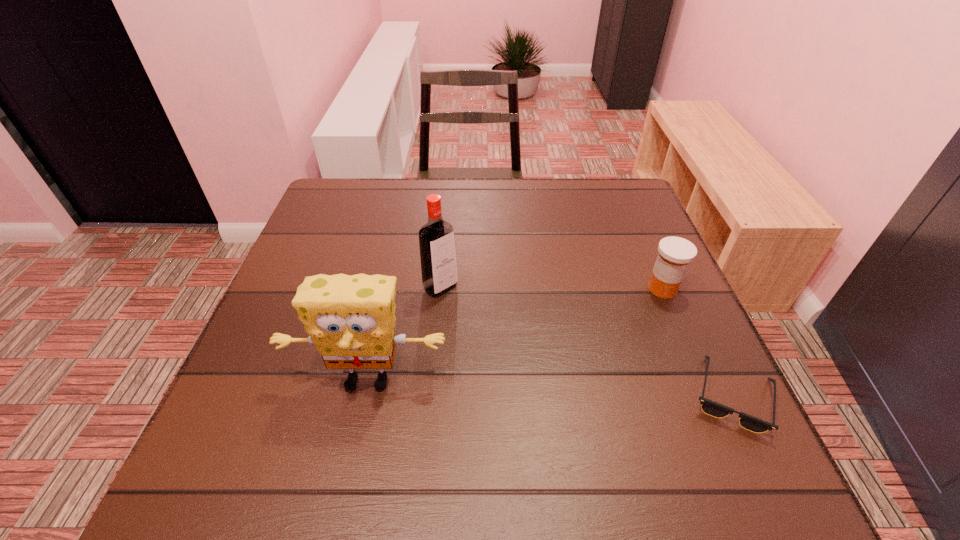
The height and width of the screenshot is (540, 960). I want to click on unoccupied position between the vodka and the sunglasses, so click(587, 341).

Find the location of a particular element. Image resolution: width=960 pixels, height=540 pixels. vacant space in between the second shortest object and the sponge is located at coordinates (515, 334).

Image resolution: width=960 pixels, height=540 pixels. In order to click on free space between the sponge and the vodka in this screenshot , I will do point(404,334).

At what (x,y) coordinates should I click in order to perform the action: click on vacant space in between the sunglasses and the medicine. Please return your answer as a coordinate pair (x, y). The image size is (960, 540). Looking at the image, I should click on (697, 342).

Identify which object is located as the nearest to the sponge. Please provide its 2D coordinates. Your answer should be formatted as a tuple, i.e. [(x, y)], where the tuple contains the x and y coordinates of a point satisfying the conditions above.

[(436, 237)]

At what (x,y) coordinates should I click in order to perform the action: click on object that can be found as the third closest to the sunglasses. Please return your answer as a coordinate pair (x, y). The width and height of the screenshot is (960, 540). Looking at the image, I should click on (436, 237).